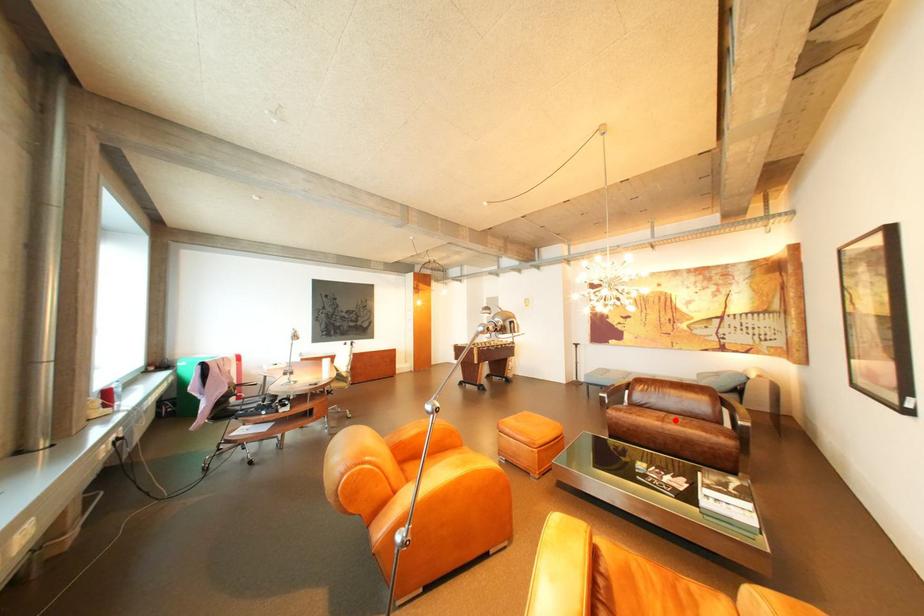
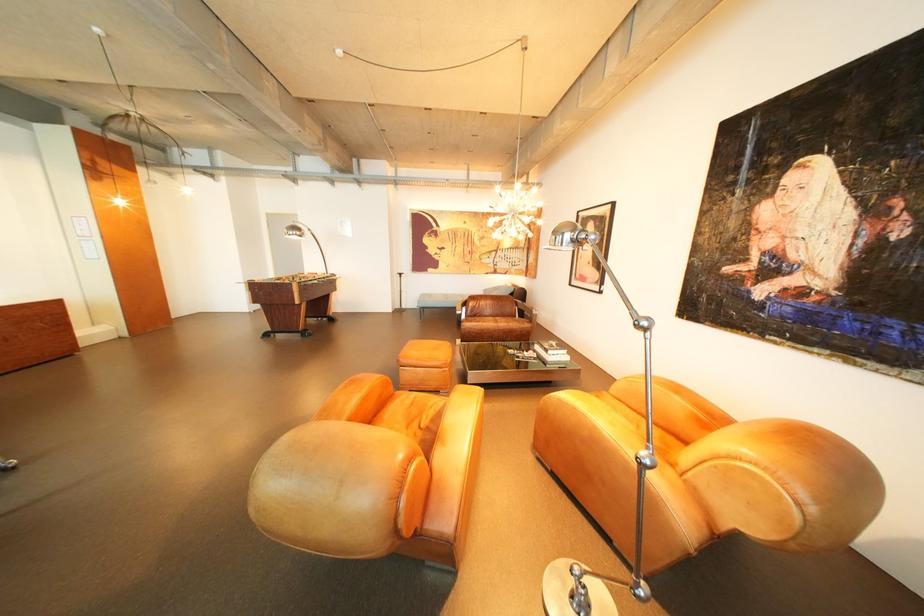
Where in the second image is the point corresponding to the highlighted location from the first image?

(509, 322)